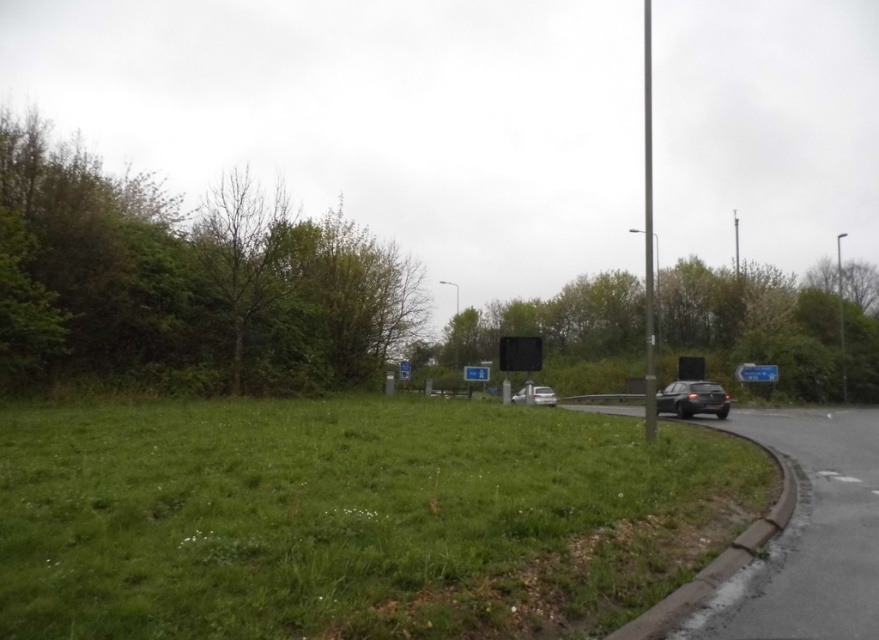
This screenshot has height=640, width=879. Describe the element at coordinates (840, 316) in the screenshot. I see `metallic pole at right` at that location.

At what (x,y) coordinates should I click in order to perform the action: click on metallic pole at right. Please return your answer as a coordinate pair (x, y). The image size is (879, 640). Looking at the image, I should click on (840, 316).

Can you confirm if metallic pole at right is positioned to the left of metallic reflective sign at center?

In fact, metallic pole at right is to the right of metallic reflective sign at center.

Between metallic pole at right and metallic reflective sign at center, which one appears on the left side from the viewer's perspective?

Positioned to the left is metallic reflective sign at center.

Between point (840, 284) and point (405, 372), which one is positioned behind?

Point (840, 284)

The height and width of the screenshot is (640, 879). I want to click on metallic pole at right, so click(840, 316).

Who is positioned more to the left, green leafy tree at center or metallic reflective sign at center?

From the viewer's perspective, metallic reflective sign at center appears more on the left side.

Is green leafy tree at center smaller than metallic reflective sign at center?

Actually, green leafy tree at center might be larger than metallic reflective sign at center.

Find the location of `green leafy tree at center`. green leafy tree at center is located at coordinates (754, 323).